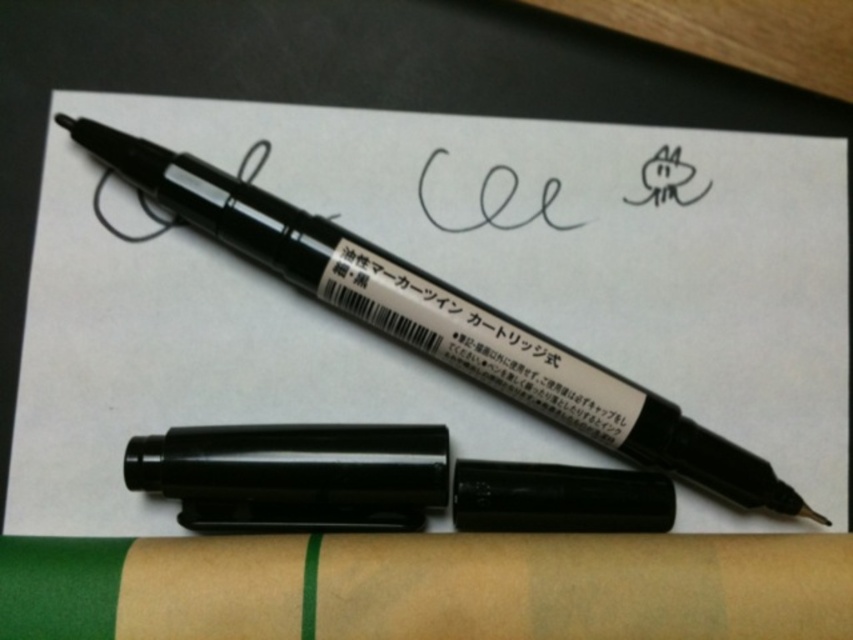
Question: Does matte black pen at center have a smaller size compared to black matte marker at center?

Choices:
 (A) yes
 (B) no

Answer: (B)

Question: Which object is closer to the camera taking this photo?

Choices:
 (A) matte black pen at center
 (B) black matte pen at center

Answer: (B)

Question: Which object appears closest to the camera in this image?

Choices:
 (A) matte black pen at center
 (B) black matte marker at center
 (C) black matte pen at center

Answer: (C)

Question: In this image, where is black matte pen at center located relative to black matte marker at center?

Choices:
 (A) right
 (B) left

Answer: (B)

Question: Which point is farther to the camera?

Choices:
 (A) matte black pen at center
 (B) black matte pen at center

Answer: (A)

Question: Is matte black pen at center closer to the viewer compared to black matte pen at center?

Choices:
 (A) yes
 (B) no

Answer: (B)